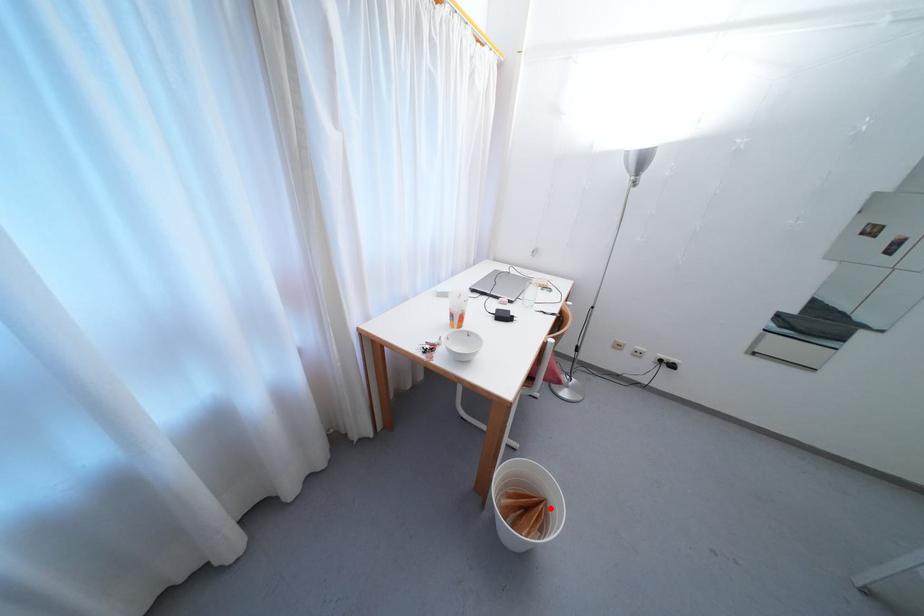
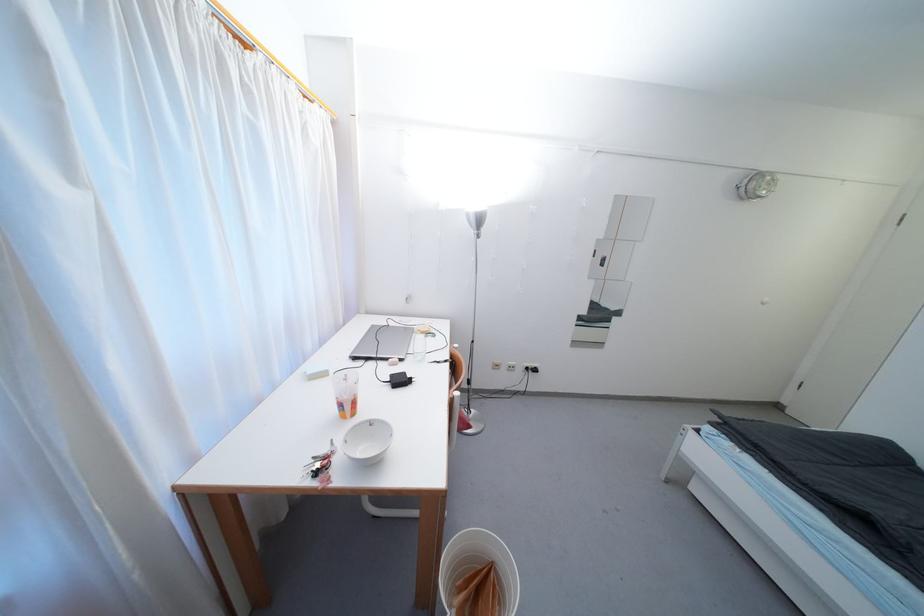
Question: I am providing you with two images of the same scene from different viewpoints. A red point is shown in image1. For the corresponding object point in image2, is it positioned nearer or farther from the camera?

Choices:
 (A) Nearer
 (B) Farther

Answer: (B)